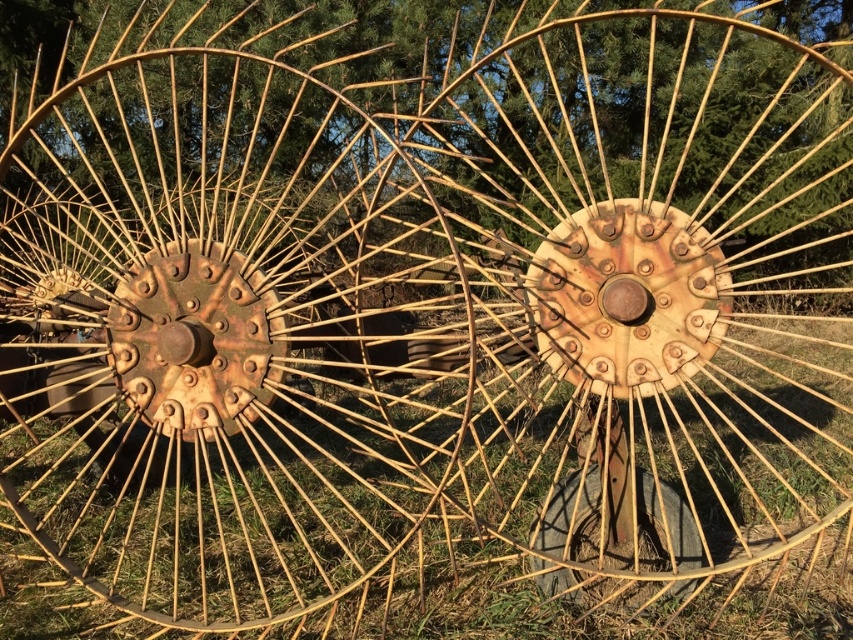
Which is behind, point (625, 252) or point (32, 305)?

The point (32, 305) is more distant.

Where is `rusty metallic spokes at center`? rusty metallic spokes at center is located at coordinates (416, 385).

Consider the image. Is rusty metallic spokes at center wider than rusty metal tire at center?

Correct, the width of rusty metallic spokes at center exceeds that of rusty metal tire at center.

Find the location of a particular element. rusty metallic spokes at center is located at coordinates (416, 385).

The width and height of the screenshot is (853, 640). Identify the location of rusty metallic spokes at center. (416, 385).

The width and height of the screenshot is (853, 640). What are the coordinates of `rusty metallic spokes at center` in the screenshot? It's located at (416, 385).

Image resolution: width=853 pixels, height=640 pixels. What do you see at coordinates (225, 336) in the screenshot?
I see `rusty metal wagon wheel at center` at bounding box center [225, 336].

Can you confirm if rusty metal wagon wheel at center is positioned below rusty metal tire at center?

No.

Which is behind, point (143, 419) or point (561, 557)?

The point (561, 557) is behind.

Image resolution: width=853 pixels, height=640 pixels. Identify the location of rusty metal wagon wheel at center. (225, 336).